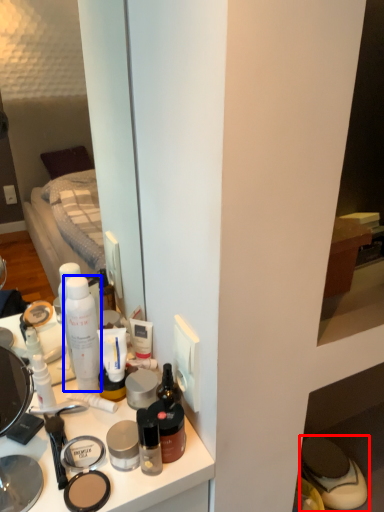
Question: Which point is closer to the camera, footwear (highlighted by a red box) or toiletry (highlighted by a blue box)?

Choices:
 (A) footwear
 (B) toiletry

Answer: (B)